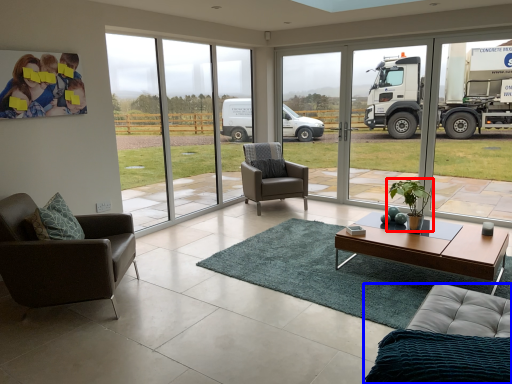
Question: Among these objects, which one is farthest to the camera, houseplant (highlighted by a red box) or studio couch (highlighted by a blue box)?

Choices:
 (A) houseplant
 (B) studio couch

Answer: (A)